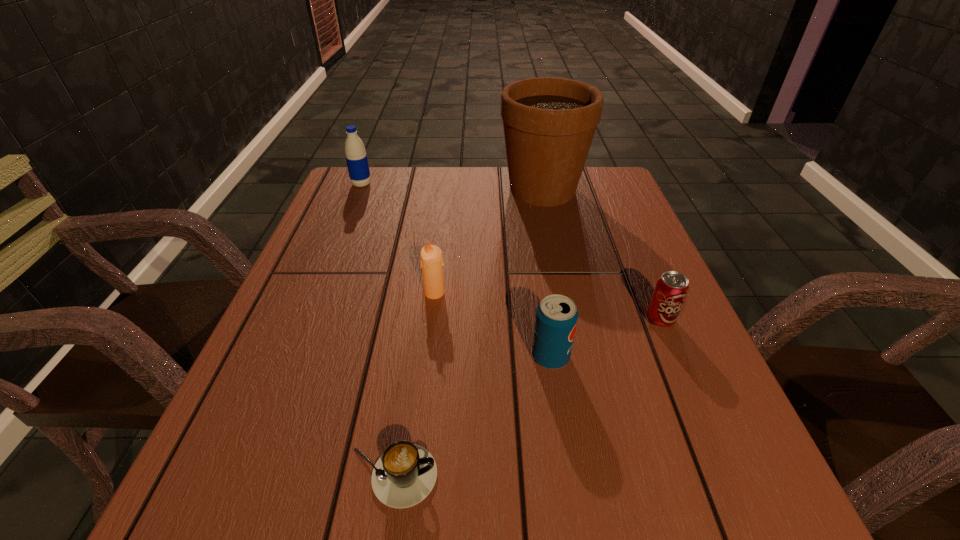
You are a GUI agent. You are given a task and a screenshot of the screen. Output one action in this format:
    pyautogui.click(x=<x>, y=<y>)
    Task: Click on the free space between the flowerpot and the third farthest object
    This screenshot has width=960, height=540.
    Given the screenshot: What is the action you would take?
    pyautogui.click(x=489, y=241)

Locate an element on the screen. The width and height of the screenshot is (960, 540). object that is the second closest one to the candle is located at coordinates (549, 123).

Point out which object is positioned as the third nearest to the taller soda. Please provide its 2D coordinates. Your answer should be formatted as a tuple, i.e. [(x, y)], where the tuple contains the x and y coordinates of a point satisfying the conditions above.

[(405, 474)]

This screenshot has height=540, width=960. I want to click on free point that satisfies the following two spatial constraints: 1. on the front side of the shorter soda; 2. on the left side of the second tallest object, so click(306, 320).

At what (x,y) coordinates should I click in order to perform the action: click on free space that satisfies the following two spatial constraints: 1. on the front side of the fifth shortest object; 2. on the left side of the tallest object. Please return your answer as a coordinate pair (x, y). Image resolution: width=960 pixels, height=540 pixels. Looking at the image, I should click on (359, 190).

Locate an element on the screen. The image size is (960, 540). free space in the image that satisfies the following two spatial constraints: 1. on the front side of the flowerpot; 2. with the handle on the side of the cappuccino is located at coordinates (603, 476).